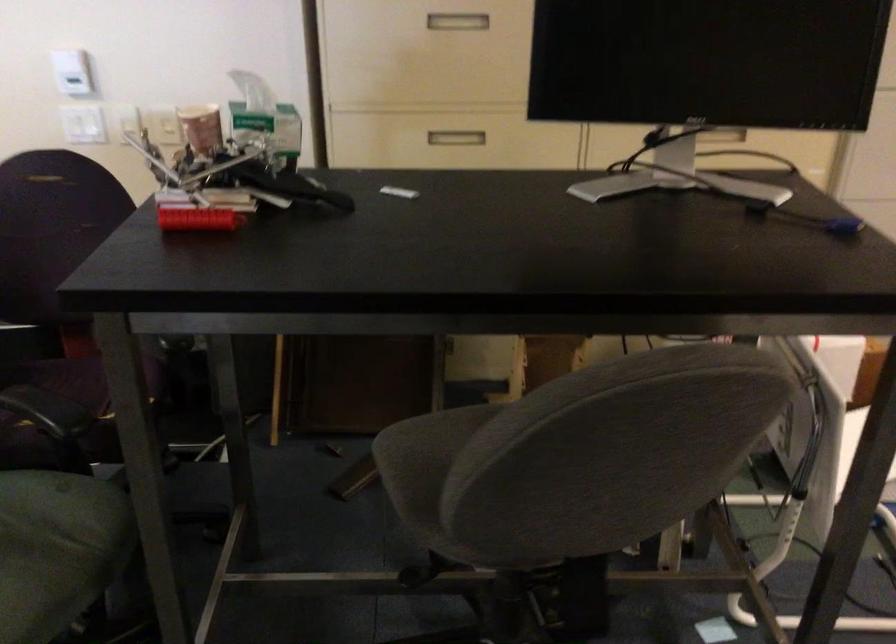
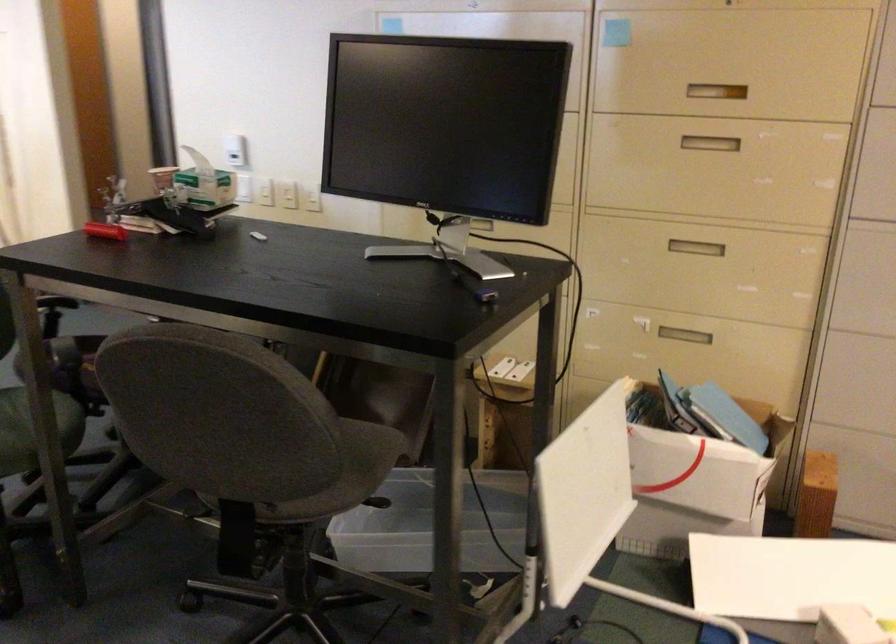
Locate, in the second image, the point that corresponds to the point at 136,129 in the first image.

(264, 192)